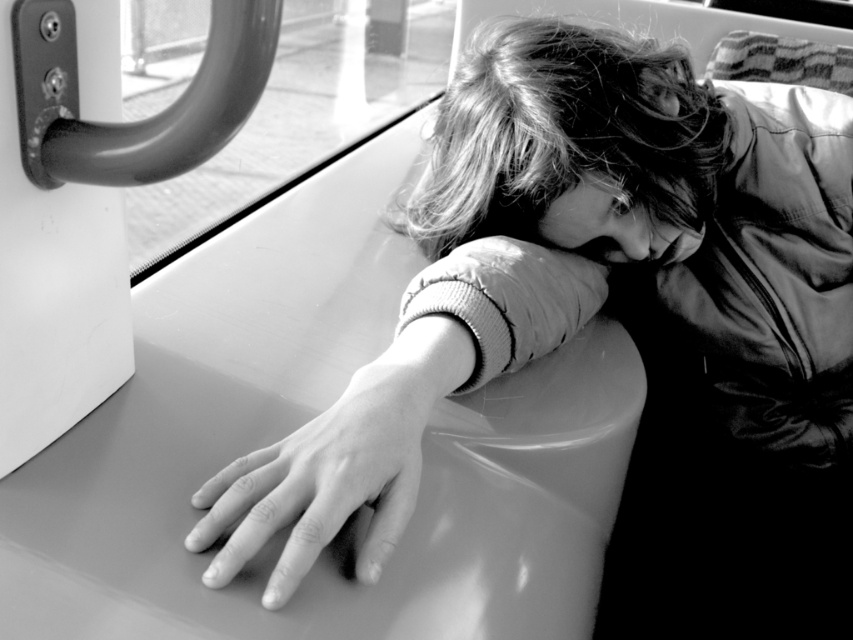
You are a photographer trying to capture the contrast between the subject and the window in this black and white photo. Since you want to highlight the subject, which object should you focus on first, the smooth hair at center or the transparent glass window at upper left?

The smooth hair at center is thinner than the transparent glass window at upper left, so focusing on the smooth hair at center first would help highlight the subject as it is narrower and more central to the composition.

You are a passenger in a public transportation vehicle and want to place your backpack on the seat next to you. The seat is at position point 0.422, 0.688. Is the smooth leather jacket at center in the way of placing your backpack there?

The smooth leather jacket at center is located at position point (585,269), which is exactly where you want to place your backpack. Therefore, the smooth leather jacket at center is in the way of placing your backpack there.

You are a photographer carrying a camera and need to place it on the seat next to the smooth leather jacket at center. The seat has a maximum load capacity of 20 pounds. Can you safely place the camera there?

The smooth leather jacket at center and camera are 14.58 inches apart from each other. However, the question about the camera placement and seat capacity isn not addressed in the provided information. The description only specifies the distance between the jacket and camera, not the weight of the camera or the seat capacity. Therefore, I cannot determine if placing the camera is safe based on the given details.